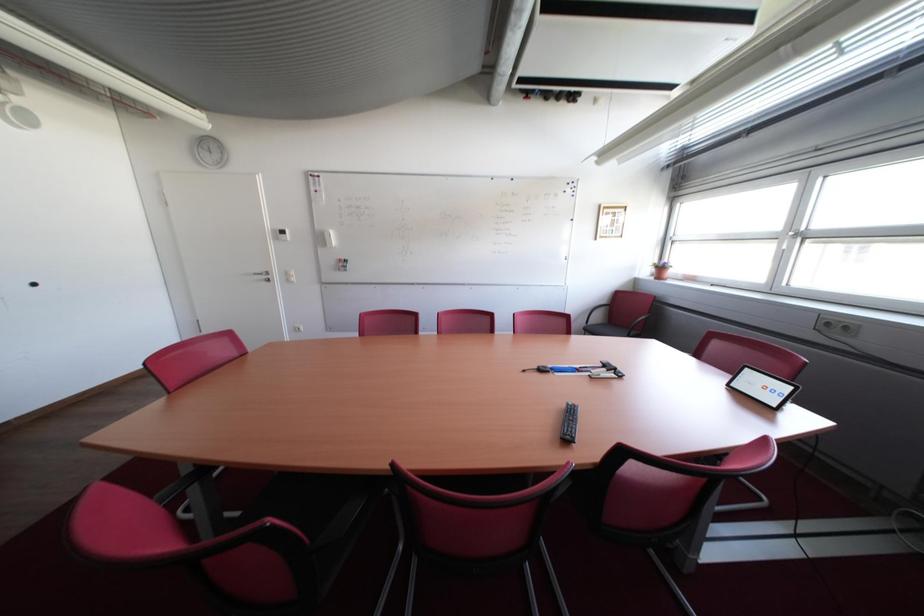
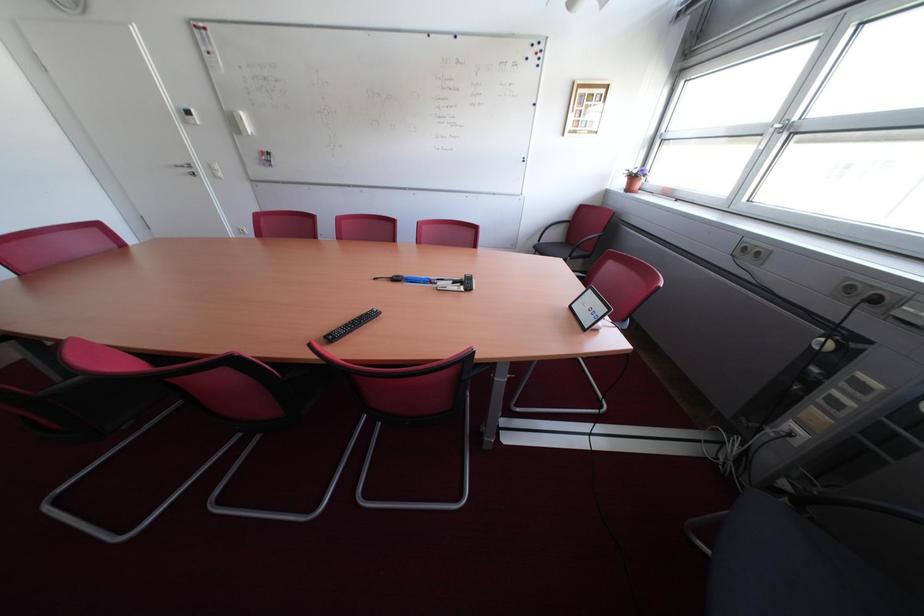
Question: The images are taken continuously from a first-person perspective. In which direction is your viewpoint rotating?

Choices:
 (A) Left
 (B) Right
 (C) Up
 (D) Down

Answer: (D)